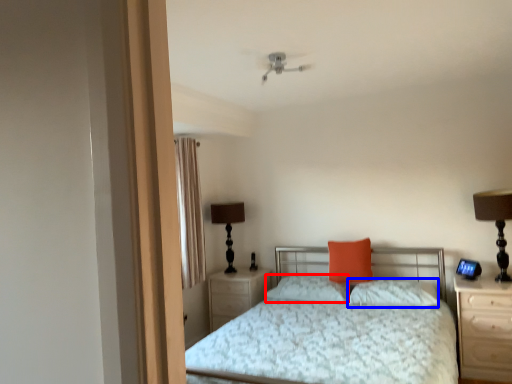
Question: Which point is closer to the camera, pillow (highlighted by a red box) or pillow (highlighted by a blue box)?

Choices:
 (A) pillow
 (B) pillow

Answer: (B)